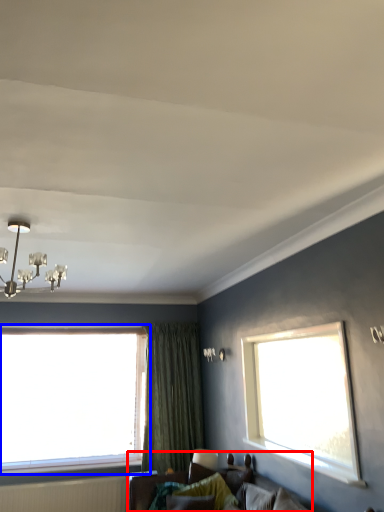
Question: Which object is further to the camera taking this photo, studio couch (highlighted by a red box) or window (highlighted by a blue box)?

Choices:
 (A) studio couch
 (B) window

Answer: (B)